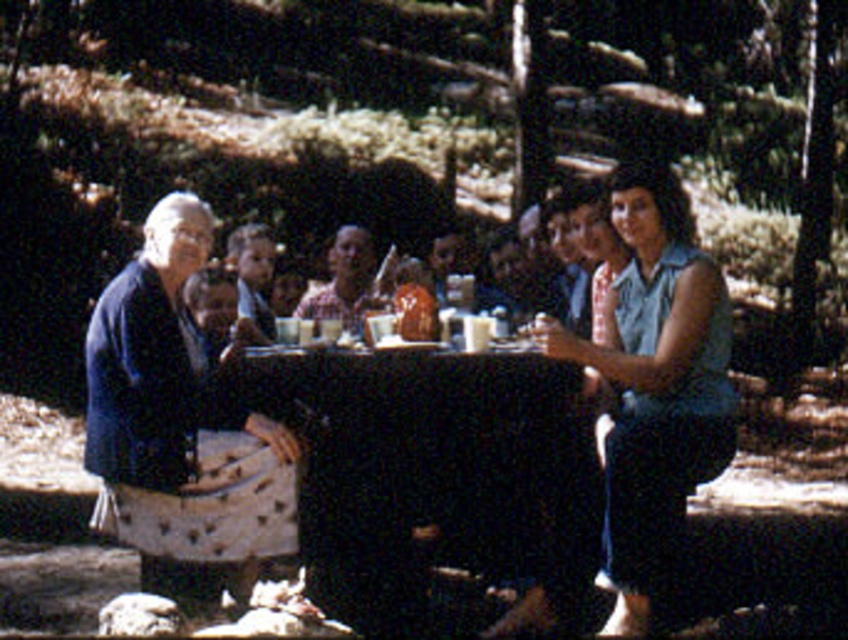
You are a photographer standing at the edge of the forest, and you want to take a photo of the black glossy table at center and the blue fabric shirt at left. Based on their positions, can you tell which object is closer to you?

The blue fabric shirt at left is closer to you because the black glossy table at center is positioned under it, meaning the shirt is above and nearer to your viewpoint.

You are sitting at the round table and want to pass a dish to the person wearing the checkered fabric shirt at center. Which direction should you pass it to ensure it reaches them, considering the blue fabric shirt at left is in the way?

The blue fabric shirt at left is in front of the checkered fabric shirt at center, so you should pass the dish around the blue fabric shirt at left to reach the checkered fabric shirt at center.